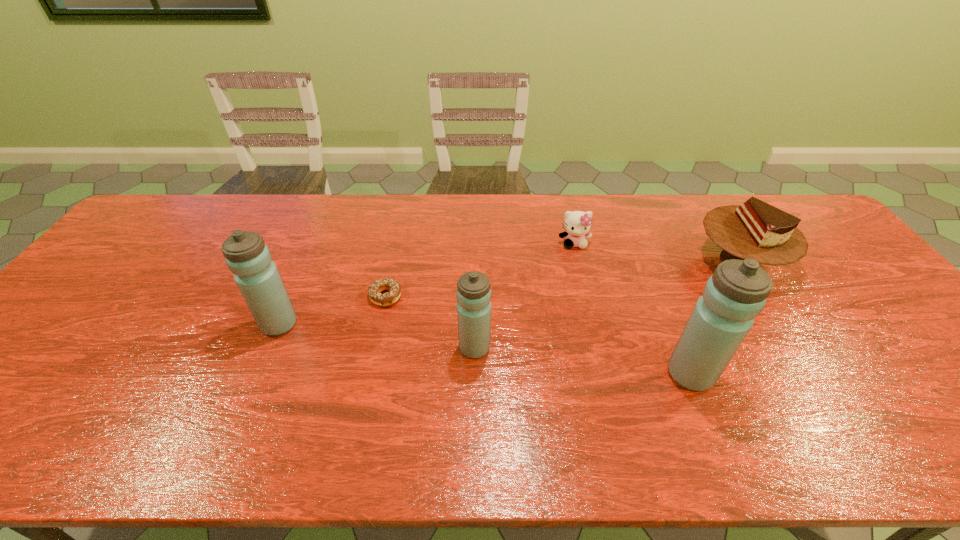
The height and width of the screenshot is (540, 960). In order to click on the second shortest water bottle in this screenshot , I will do `click(246, 255)`.

Find the location of a particular element. the leftmost water bottle is located at coordinates (246, 255).

The width and height of the screenshot is (960, 540). What are the coordinates of `the third object from left to right` in the screenshot? It's located at (473, 292).

Find the location of `the second water bottle from left to right`. the second water bottle from left to right is located at coordinates (473, 292).

At what (x,y) coordinates should I click in order to perform the action: click on the second object from right to left. Please return your answer as a coordinate pair (x, y). This screenshot has height=540, width=960. Looking at the image, I should click on (736, 293).

Identify the location of the third object from right to left. (577, 224).

What are the coordinates of `the fifth tallest object` in the screenshot? It's located at (577, 224).

In order to click on the rightmost object in this screenshot , I will do `click(757, 230)`.

Where is `the third shortest object`? The width and height of the screenshot is (960, 540). the third shortest object is located at coordinates (757, 230).

The width and height of the screenshot is (960, 540). I want to click on doughnut, so pos(374,289).